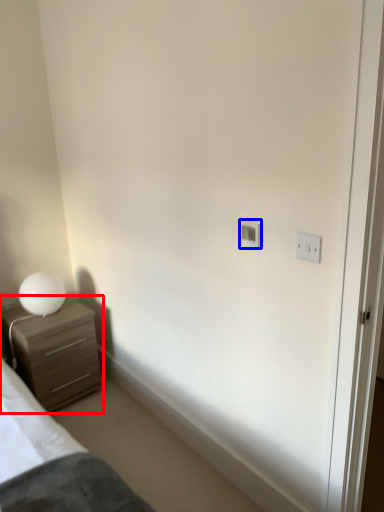
Question: Which object is further to the camera taking this photo, chest of drawers (highlighted by a red box) or light switch (highlighted by a blue box)?

Choices:
 (A) chest of drawers
 (B) light switch

Answer: (A)